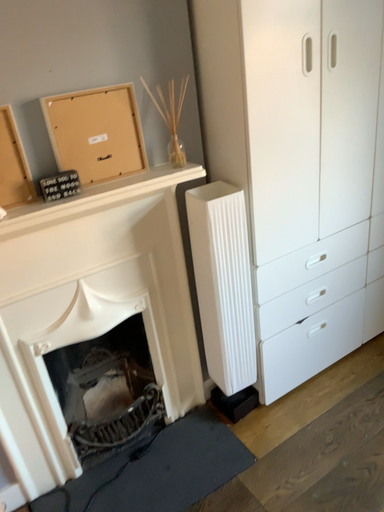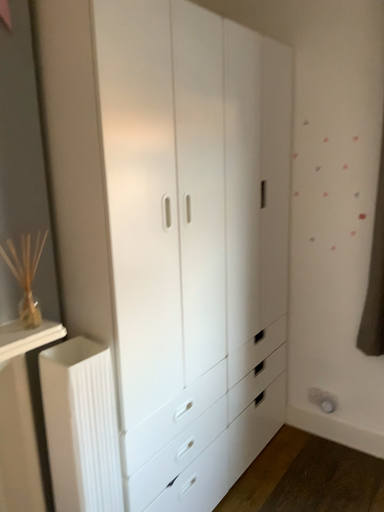
Question: Which way did the camera rotate in the video?

Choices:
 (A) rotated right
 (B) rotated left

Answer: (A)